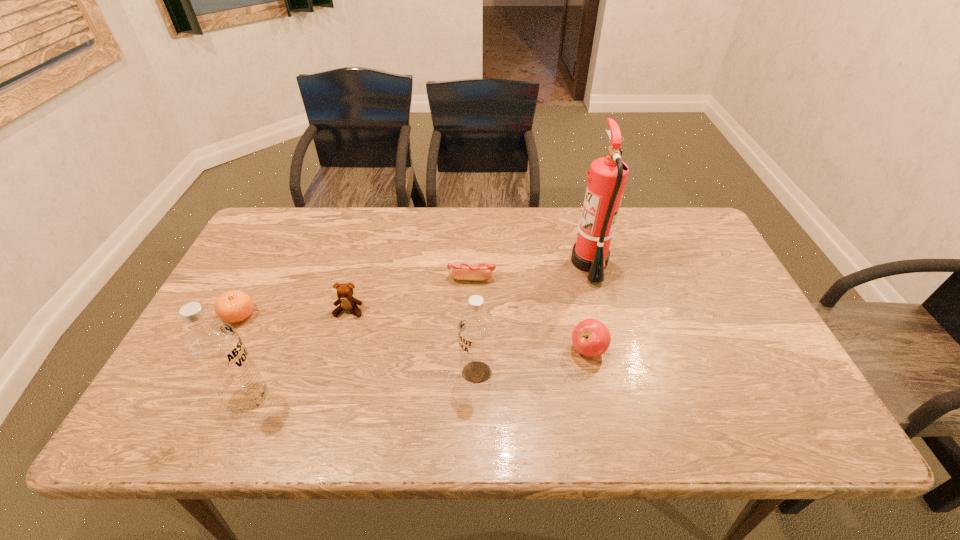
Locate an element on the screen. object that ranks as the third closest to the apple is located at coordinates (461, 271).

Choose which object is the fourth nearest neighbor to the teddy bear. Please provide its 2D coordinates. Your answer should be formatted as a tuple, i.e. [(x, y)], where the tuple contains the x and y coordinates of a point satisfying the conditions above.

[(476, 330)]

Where is `free space that satisfies the following two spatial constraints: 1. at the nozzle of the tallest object; 2. on the front-facing side of the teddy bear`? The width and height of the screenshot is (960, 540). free space that satisfies the following two spatial constraints: 1. at the nozzle of the tallest object; 2. on the front-facing side of the teddy bear is located at coordinates (603, 310).

This screenshot has height=540, width=960. I want to click on free point that satisfies the following two spatial constraints: 1. on the front-facing side of the teddy bear; 2. on the front label of the second object from left to right, so click(x=324, y=399).